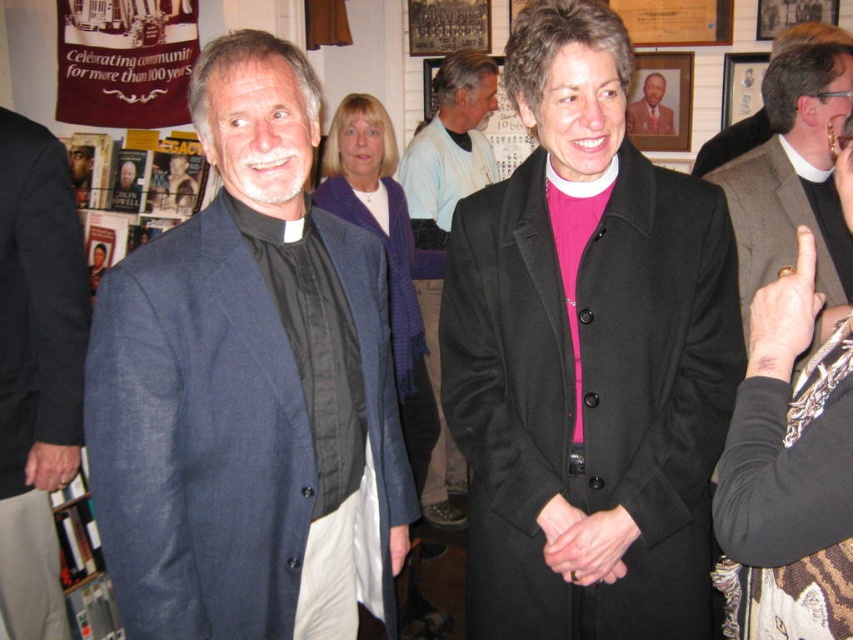
Is gray wool vest at right taller than wooden portrait frame at upper center?

Indeed, gray wool vest at right has a greater height compared to wooden portrait frame at upper center.

Does gray wool vest at right have a larger size compared to wooden portrait frame at upper center?

Correct, gray wool vest at right is larger in size than wooden portrait frame at upper center.

Is point (813, 218) farther from camera compared to point (682, 140)?

No, (813, 218) is in front of (682, 140).

The height and width of the screenshot is (640, 853). I want to click on gray wool vest at right, so click(x=793, y=173).

Does blue linen suit at center appear over gray wool vest at right?

Actually, blue linen suit at center is below gray wool vest at right.

Is blue linen suit at center positioned before gray wool vest at right?

Yes, blue linen suit at center is in front of gray wool vest at right.

Between point (93, 499) and point (807, 138), which one is positioned in front?

Point (93, 499)

Where is `blue linen suit at center`? The image size is (853, 640). blue linen suit at center is located at coordinates (247, 385).

Which of these two, wooden portrait frame at upper center or brown leather jacket at center, stands shorter?

Standing shorter between the two is brown leather jacket at center.

Can you confirm if wooden portrait frame at upper center is positioned below brown leather jacket at center?

No.

Between point (682, 122) and point (659, 104), which one is positioned behind?

Positioned behind is point (659, 104).

The image size is (853, 640). In order to click on wooden portrait frame at upper center in this screenshot , I will do `click(660, 100)`.